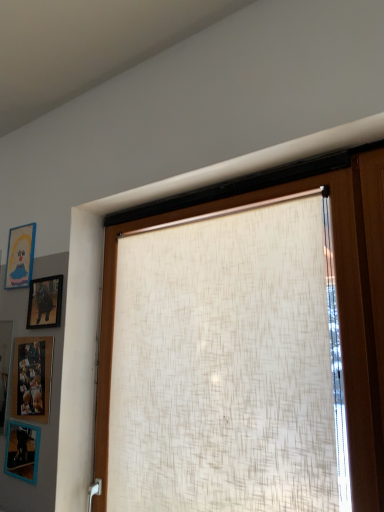
Question: From the image's perspective, is blue matte picture frame at upper left, which is the 1th picture frame in top-to-bottom order, located above or below beige textured roller blind at center?

Choices:
 (A) below
 (B) above

Answer: (B)

Question: In terms of size, does blue matte picture frame at upper left, marked as the 4th picture frame in a bottom-to-top arrangement, appear bigger or smaller than beige textured roller blind at center?

Choices:
 (A) small
 (B) big

Answer: (A)

Question: Based on their relative distances, which object is nearer to the blue plastic picture frame at lower left, which ranks as the 4th picture frame in top-to-bottom order?

Choices:
 (A) matte black picture frame at upper left, the 2th picture frame positioned from the top
 (B) beige textured roller blind at center
 (C) blue matte picture frame at upper left, which is the 1th picture frame in top-to-bottom order
 (D) wooden picture frame at lower left, placed as the third picture frame when sorted from top to bottom

Answer: (D)

Question: Considering the real-world distances, which object is farthest from the blue plastic picture frame at lower left, acting as the 1th picture frame starting from the bottom?

Choices:
 (A) blue matte picture frame at upper left, marked as the 4th picture frame in a bottom-to-top arrangement
 (B) beige textured roller blind at center
 (C) matte black picture frame at upper left, the 2th picture frame positioned from the top
 (D) wooden picture frame at lower left, which is the second picture frame from bottom to top

Answer: (A)